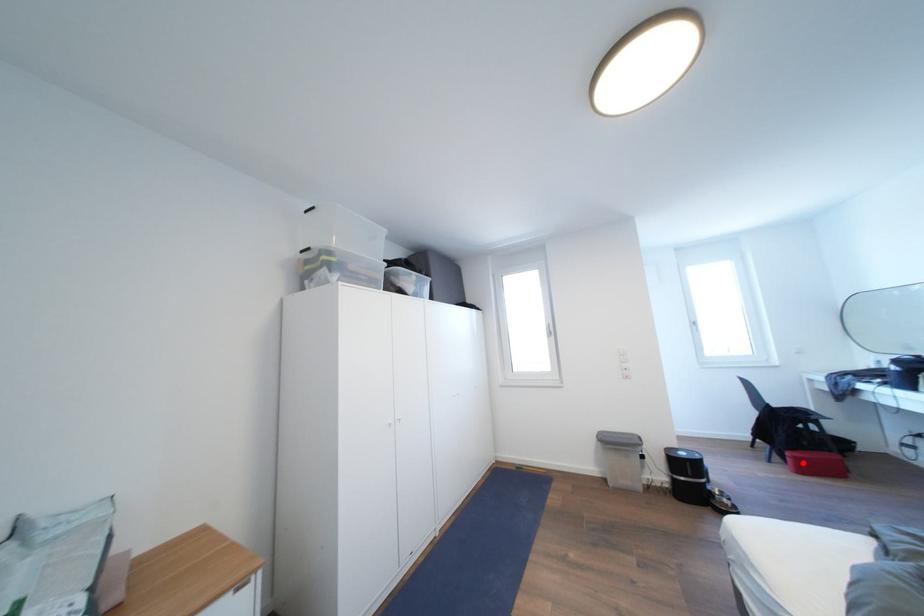
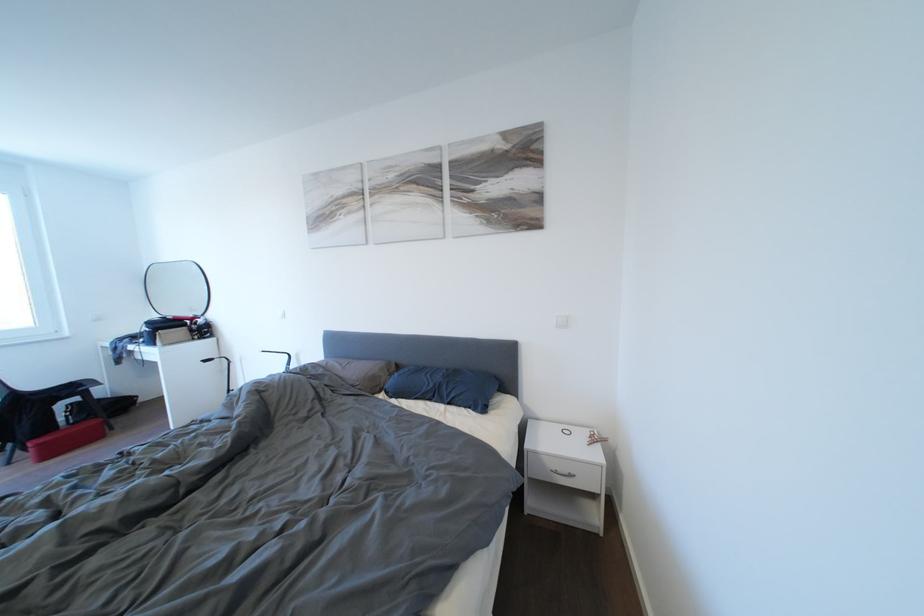
Question: I am providing you with two images of the same scene from different viewpoints. A red point is marked on the first image. Can you still see the location of the red point in image 2?

Choices:
 (A) Yes
 (B) No

Answer: (A)